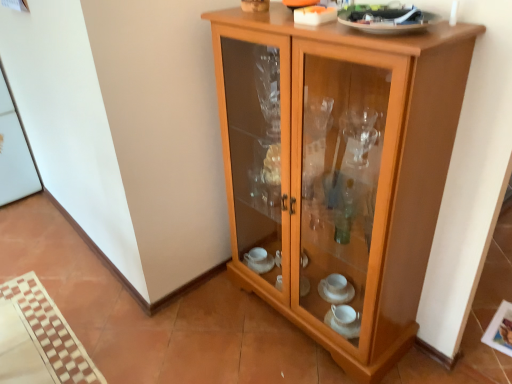
What do you see at coordinates (339, 169) in the screenshot? Image resolution: width=512 pixels, height=384 pixels. I see `wooden cabinet at center` at bounding box center [339, 169].

Identify the location of wooden cabinet at center. The height and width of the screenshot is (384, 512). tap(339, 169).

From the picture: What is the approximate width of wooden cabinet at center?

wooden cabinet at center is 33.96 centimeters wide.

Image resolution: width=512 pixels, height=384 pixels. In order to click on wooden cabinet at center in this screenshot , I will do `click(339, 169)`.